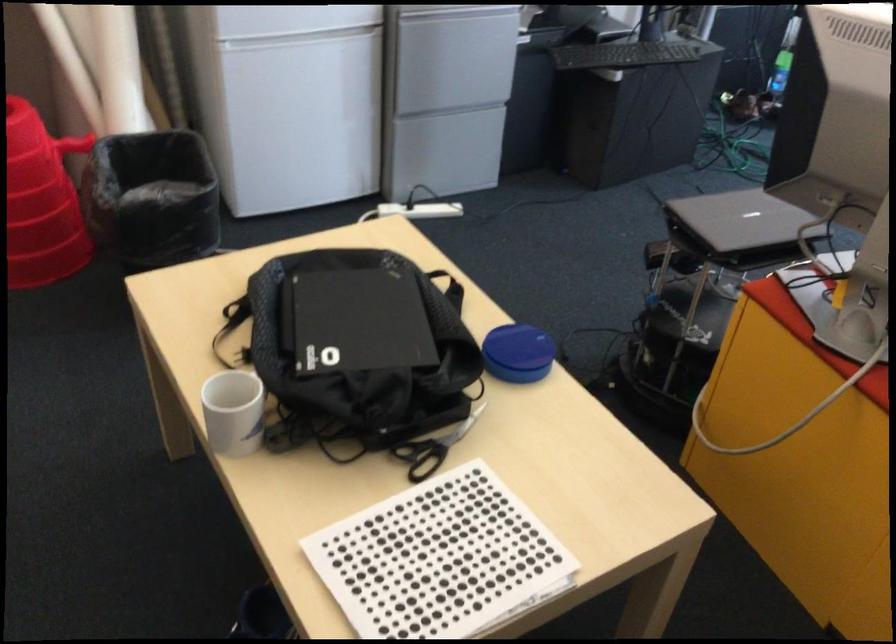
The height and width of the screenshot is (644, 896). In order to click on cabinet drawer handle in this screenshot , I will do `click(449, 109)`.